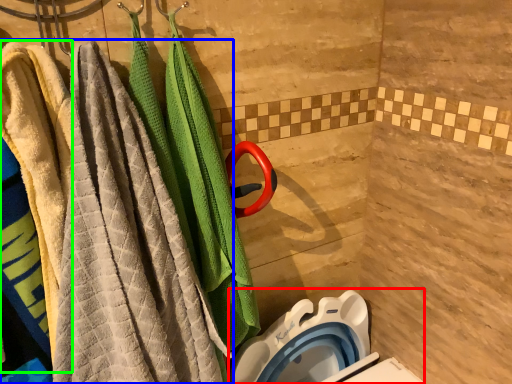
Question: Which object is positioned farthest from toilet bowl (highlighted by a red box)? Select from towel (highlighted by a blue box) and beach towel (highlighted by a green box).

Choices:
 (A) towel
 (B) beach towel

Answer: (B)